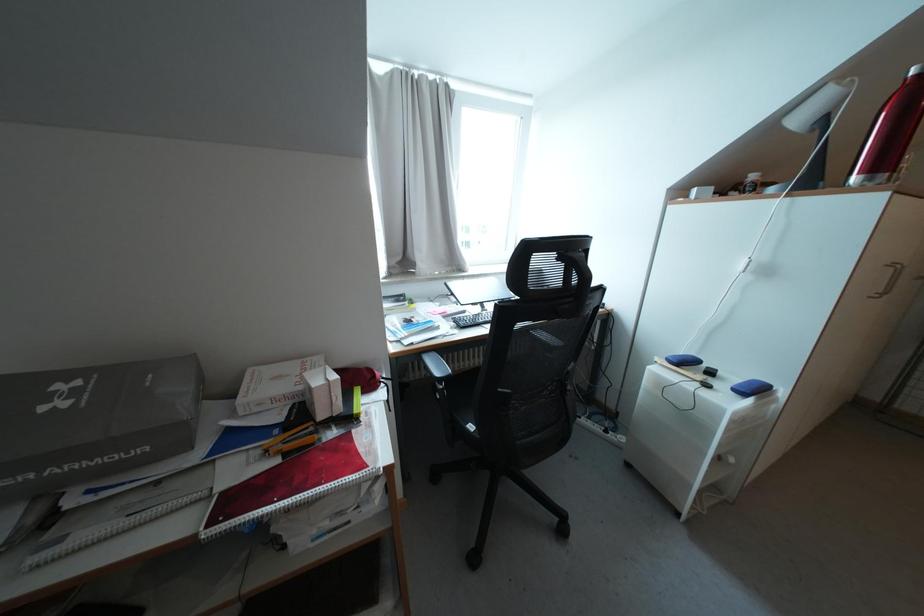
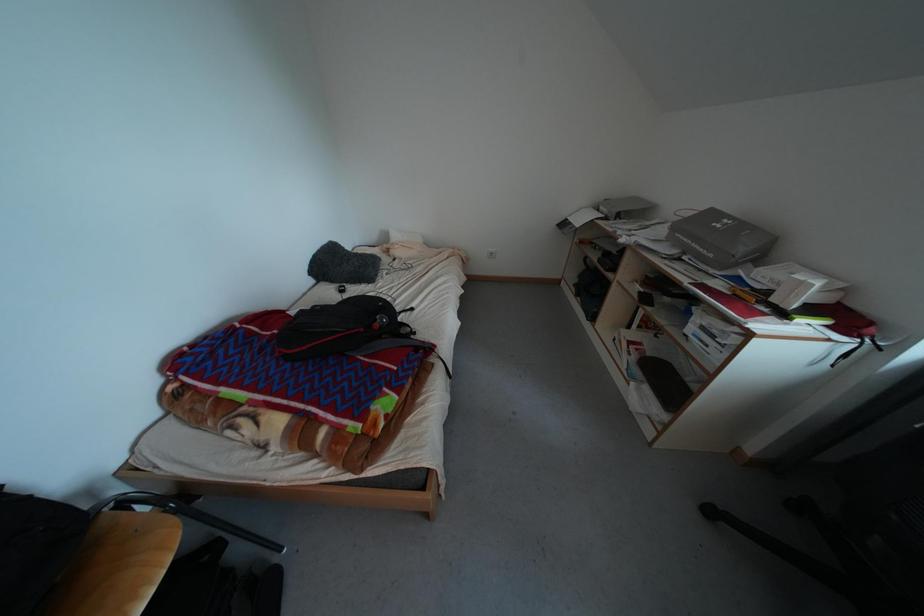
The first image is from the beginning of the video and the second image is from the end. How did the camera likely rotate when shooting the video?

The camera rotated toward left-down.